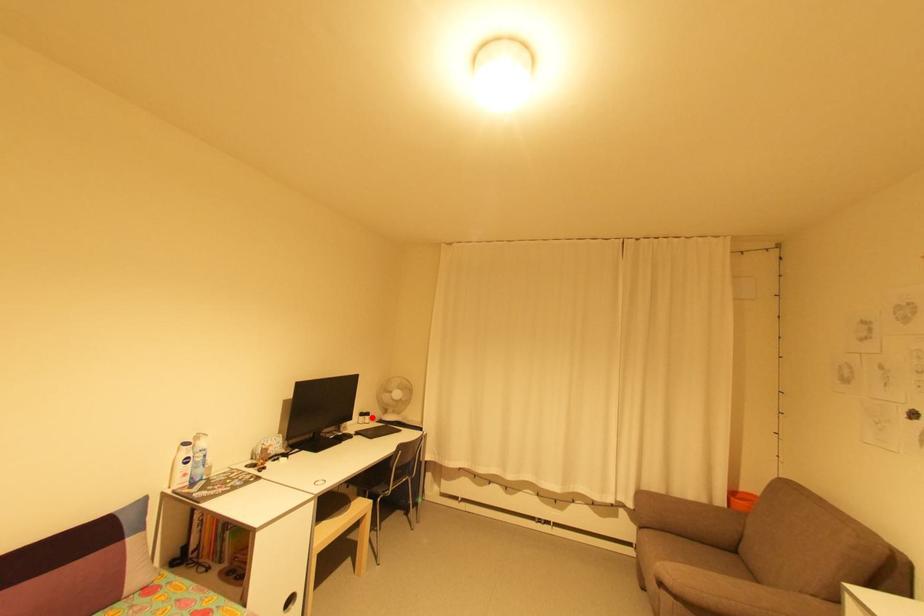
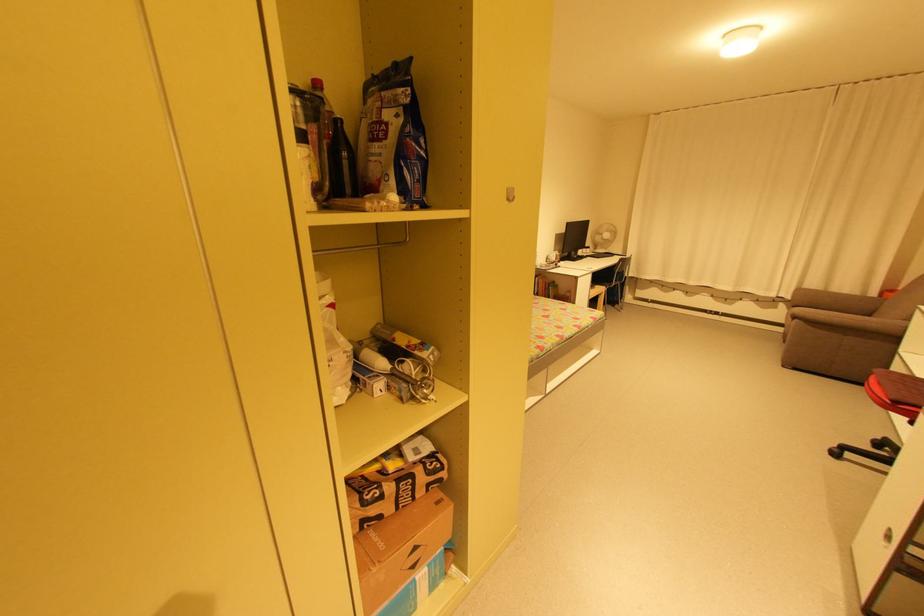
Question: I am providing you with two images of the same scene from different viewpoints. A red point is marked on the first image. Is the red point's position out of view in image 2?

Choices:
 (A) Yes
 (B) No

Answer: (B)